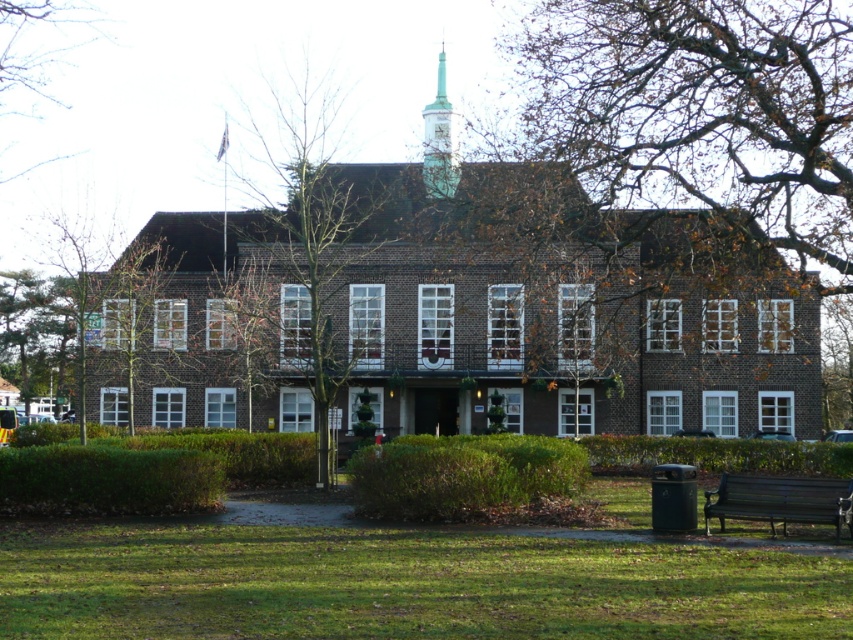
From the picture: You are standing at the entrance of the building and want to walk to the point marked as point (225,364). Which direction should you go relative to point (264,227)?

Since point (264,227) is in front of point (225,364), you should walk behind point (264,227) to reach point (225,364).

You are standing at the entrance of the building and looking towards the green spire. Where is the brown leafy tree at upper center located relative to your viewpoint?

The brown leafy tree at upper center is located at coordinates point (695,113) relative to your viewpoint.